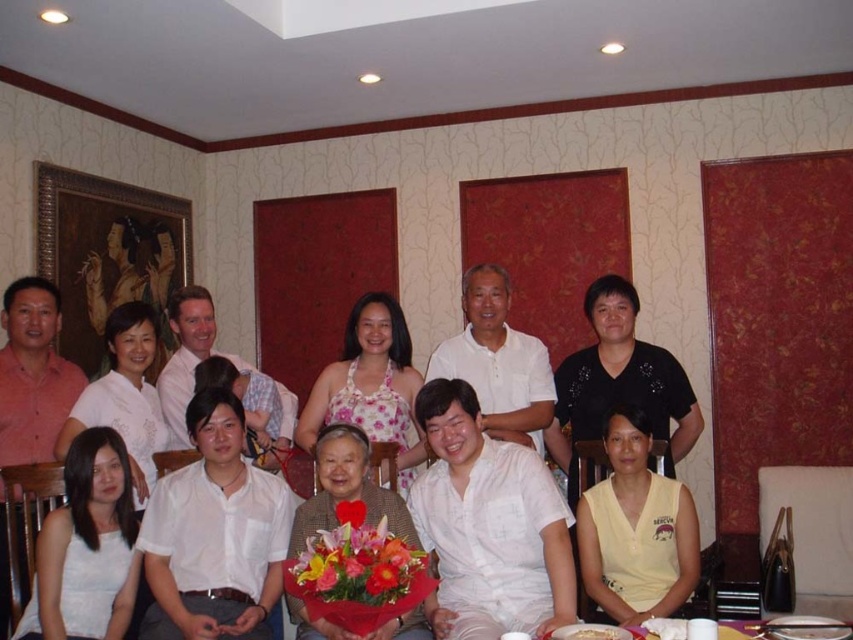
Question: Is white cotton shirt at center below white satin dress at lower left?

Choices:
 (A) no
 (B) yes

Answer: (A)

Question: Which point is farther to the camera?

Choices:
 (A) white satin blouse at center
 (B) white paper plate at lower center
 (C) floral print dress at center

Answer: (C)

Question: Is white satin dress at lower left to the right of floral print dress at center from the viewer's perspective?

Choices:
 (A) yes
 (B) no

Answer: (B)

Question: Is the position of white cotton shirt at center more distant than that of white satin dress at lower left?

Choices:
 (A) no
 (B) yes

Answer: (B)

Question: Which object is the farthest from the floral print dress at center?

Choices:
 (A) white paper plate at lower center
 (B) white satin blouse at center

Answer: (A)

Question: Which point is farther from the camera taking this photo?

Choices:
 (A) (357, 340)
 (B) (321, 621)
 (C) (77, 557)

Answer: (A)